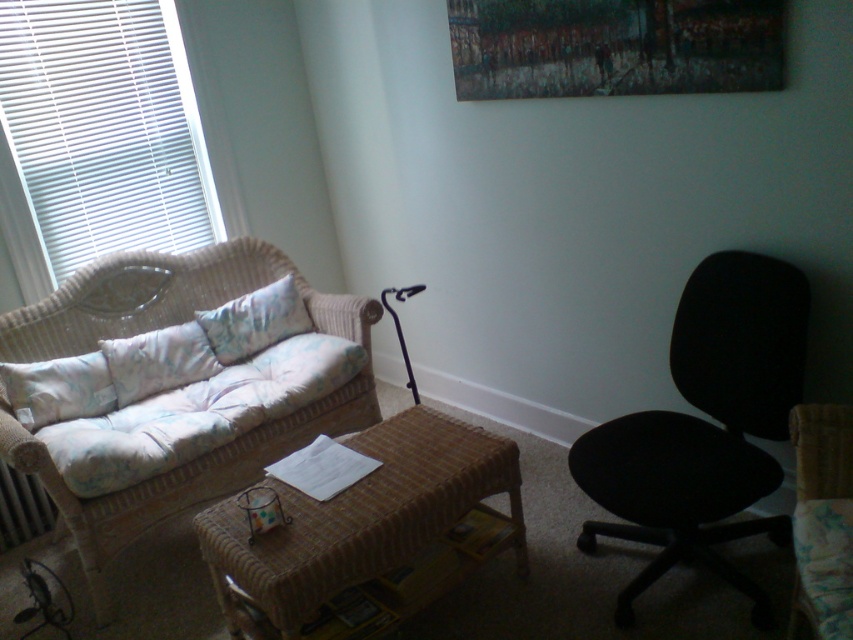
Question: Which of the following is the closest to the observer?

Choices:
 (A) (189, 397)
 (B) (508, 449)

Answer: (B)

Question: Can you confirm if woven brown table at center is wider than fluffy white pillow at center?

Choices:
 (A) no
 (B) yes

Answer: (B)

Question: Estimate the real-world distances between objects in this image. Which object is closer to the fluffy white pillow at center?

Choices:
 (A) white blinds at left
 (B) fluffy pastel pillow at left
 (C) woven wicker couch at left

Answer: (C)

Question: Is white blinds at left to the right of fluffy white pillow at left from the viewer's perspective?

Choices:
 (A) no
 (B) yes

Answer: (B)

Question: Does black fabric office chair at right have a greater width compared to fluffy pastel pillow at left?

Choices:
 (A) yes
 (B) no

Answer: (A)

Question: Which point is farther to the camera?

Choices:
 (A) fluffy white pillow at center
 (B) black fabric swivel chair at right

Answer: (A)